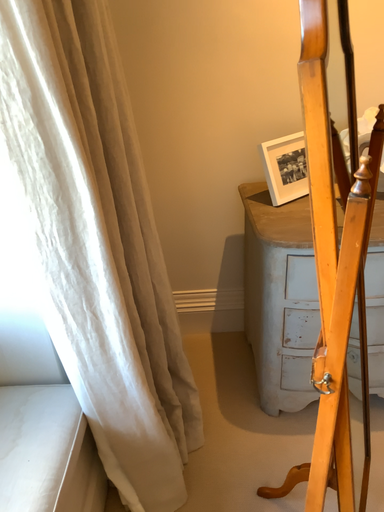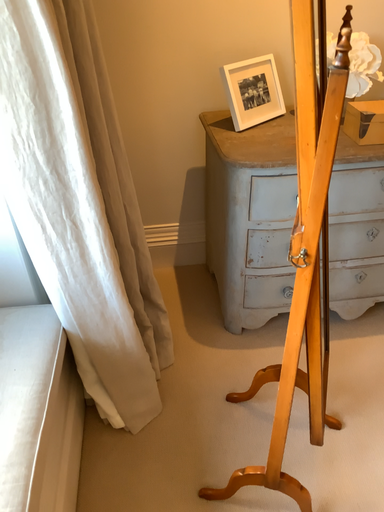
Question: Which way did the camera rotate in the video?

Choices:
 (A) rotated right
 (B) rotated left

Answer: (A)